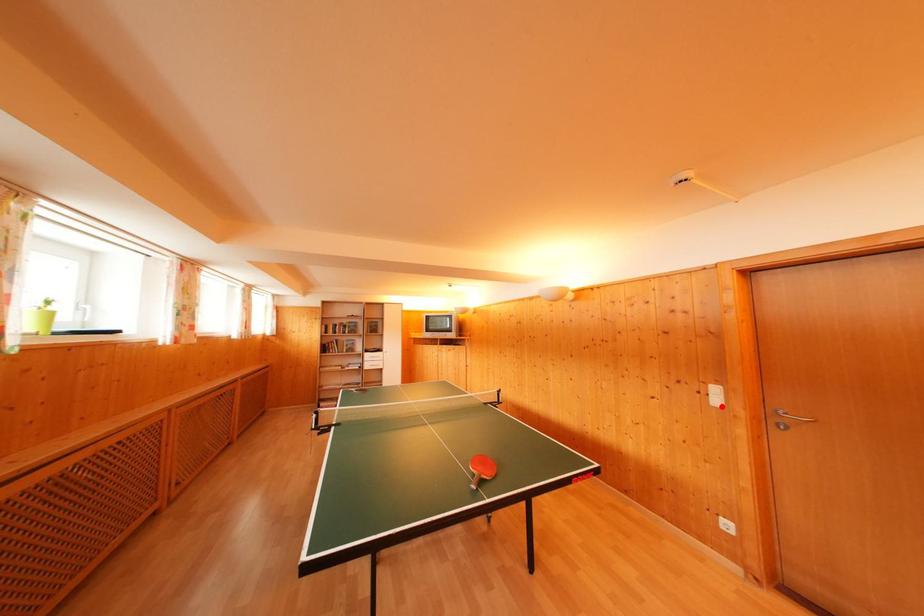
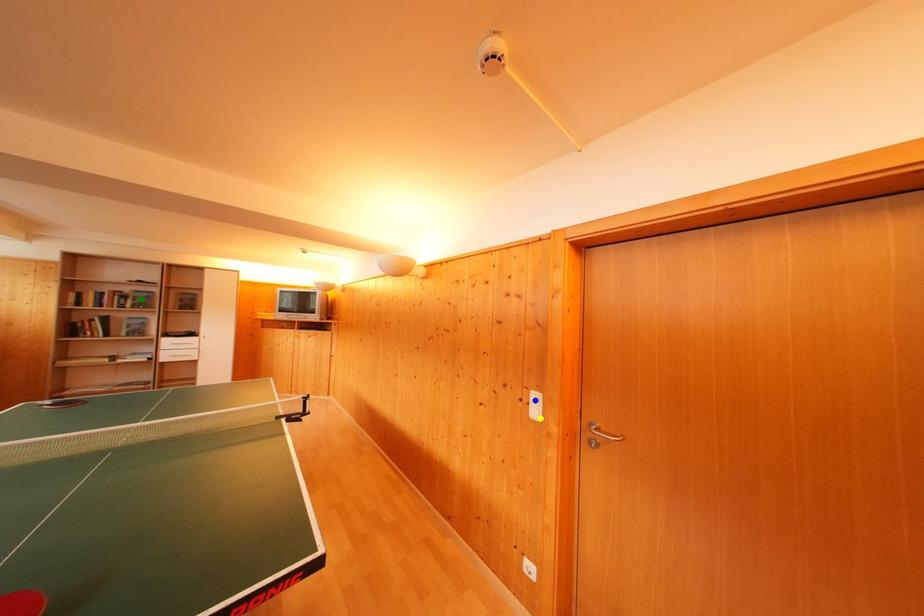
Question: I am providing you with two images of the same scene from different viewpoints. A red point is marked on the first image. You are given multiple points on the second image. In image 2, which mark is for the same physical point as the one in image 1?

Choices:
 (A) yellow point
 (B) blue point
 (C) green point

Answer: (A)